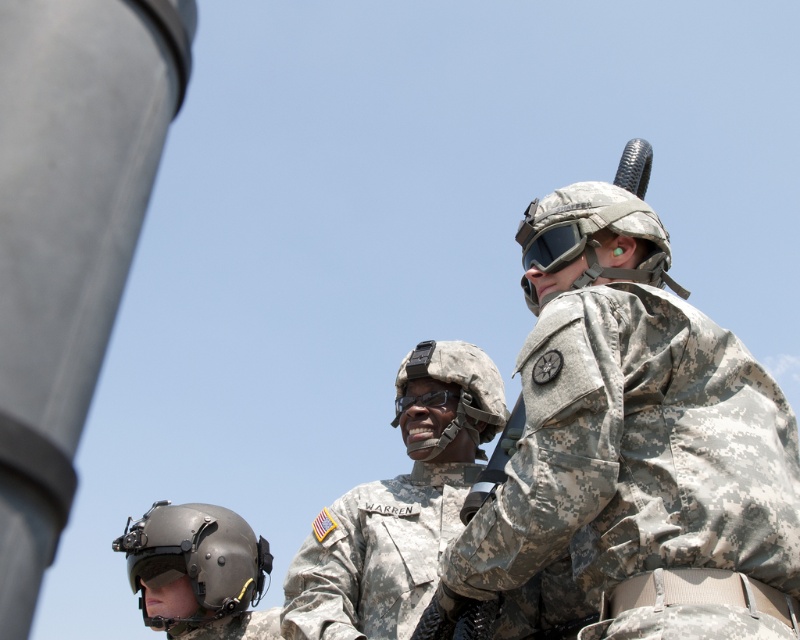
Question: Which of the following is the farthest from the observer?

Choices:
 (A) matte black helmet at lower left
 (B) matte black goggles at upper center
 (C) camouflage fabric uniform at right
 (D) matte black goggles at center

Answer: (A)

Question: Which point is closer to the camera?

Choices:
 (A) (350, 516)
 (B) (628, 236)
 (C) (441, 394)
 (D) (44, 108)

Answer: (D)

Question: Is camouflage uniform at center to the left of matte black helmet at lower left from the viewer's perspective?

Choices:
 (A) no
 (B) yes

Answer: (A)

Question: Is camouflage uniform at center thinner than matte black helmet at lower left?

Choices:
 (A) yes
 (B) no

Answer: (B)

Question: In this image, where is smooth gray pole at left located relative to camouflage fabric helmet at center?

Choices:
 (A) above
 (B) below

Answer: (A)

Question: Which object appears farthest from the camera in this image?

Choices:
 (A) camouflage uniform at center
 (B) matte black goggles at center
 (C) camouflage fabric helmet at center

Answer: (B)